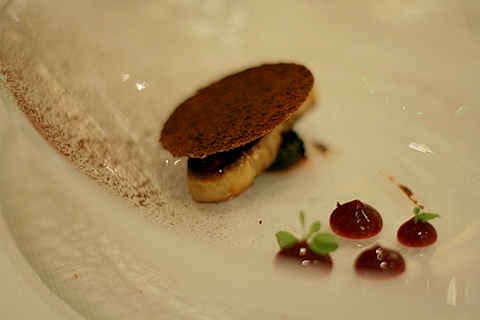
Locate an element on the screen. white plate is located at coordinates (344, 62).